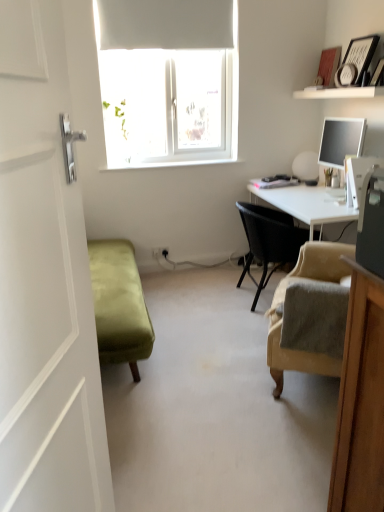
Question: Is beige fabric armchair at lower right, the second chair positioned from the back, far away from black woven chair at center, acting as the first chair starting from the back?

Choices:
 (A) no
 (B) yes

Answer: (A)

Question: From a real-world perspective, is beige fabric armchair at lower right, the second chair positioned from the back, located higher than black woven chair at center, arranged as the second chair when viewed from the front?

Choices:
 (A) no
 (B) yes

Answer: (B)

Question: Considering the relative sizes of beige fabric armchair at lower right, the second chair positioned from the back, and black woven chair at center, acting as the first chair starting from the back, in the image provided, is beige fabric armchair at lower right, the second chair positioned from the back, bigger than black woven chair at center, acting as the first chair starting from the back,?

Choices:
 (A) no
 (B) yes

Answer: (A)

Question: Is beige fabric armchair at lower right, the 1th chair viewed from the front, facing away from black woven chair at center, acting as the first chair starting from the back?

Choices:
 (A) yes
 (B) no

Answer: (B)

Question: Is beige fabric armchair at lower right, the second chair positioned from the back, outside of black woven chair at center, arranged as the second chair when viewed from the front?

Choices:
 (A) no
 (B) yes

Answer: (B)

Question: Relative to white matte table lamp at right, is black woven chair at center, arranged as the second chair when viewed from the front, in front or behind?

Choices:
 (A) front
 (B) behind

Answer: (A)

Question: From a real-world perspective, relative to white matte table lamp at right, is black woven chair at center, arranged as the second chair when viewed from the front, vertically above or below?

Choices:
 (A) above
 (B) below

Answer: (B)

Question: Is black woven chair at center, arranged as the second chair when viewed from the front, bigger or smaller than white matte table lamp at right?

Choices:
 (A) big
 (B) small

Answer: (A)

Question: Looking at their shapes, would you say black woven chair at center, acting as the first chair starting from the back, is wider or thinner than white matte table lamp at right?

Choices:
 (A) thin
 (B) wide

Answer: (B)

Question: Considering the relative positions of black woven chair at center, arranged as the second chair when viewed from the front, and beige fabric armchair at lower right, the second chair positioned from the back, in the image provided, is black woven chair at center, arranged as the second chair when viewed from the front, to the left or to the right of beige fabric armchair at lower right, the second chair positioned from the back,?

Choices:
 (A) left
 (B) right

Answer: (B)

Question: Looking at their shapes, would you say black woven chair at center, acting as the first chair starting from the back, is wider or thinner than beige fabric armchair at lower right, the 1th chair viewed from the front?

Choices:
 (A) wide
 (B) thin

Answer: (A)

Question: Relative to beige fabric armchair at lower right, the second chair positioned from the back, is black woven chair at center, arranged as the second chair when viewed from the front, in front or behind?

Choices:
 (A) front
 (B) behind

Answer: (B)

Question: From a real-world perspective, is black woven chair at center, acting as the first chair starting from the back, positioned above or below beige fabric armchair at lower right, the second chair positioned from the back?

Choices:
 (A) below
 (B) above

Answer: (A)

Question: Is point (264, 228) positioned closer to the camera than point (342, 91)?

Choices:
 (A) farther
 (B) closer

Answer: (A)

Question: Is black woven chair at center, arranged as the second chair when viewed from the front, taller or shorter than white matte shelf at upper right?

Choices:
 (A) short
 (B) tall

Answer: (B)